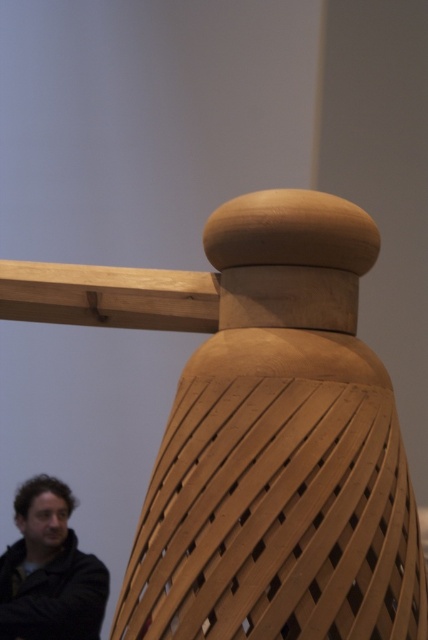
Question: Which object is farther from the camera taking this photo?

Choices:
 (A) dark brown leather jacket at lower left
 (B) natural wood chair at center

Answer: (A)

Question: Which point is farther from the camera taking this photo?

Choices:
 (A) (262, 256)
 (B) (80, 636)

Answer: (B)

Question: Which of the following is the farthest from the observer?

Choices:
 (A) (413, 605)
 (B) (67, 557)

Answer: (B)

Question: Is natural wood chair at center to the left of dark brown leather jacket at lower left from the viewer's perspective?

Choices:
 (A) no
 (B) yes

Answer: (A)

Question: Is natural wood chair at center to the left of dark brown leather jacket at lower left from the viewer's perspective?

Choices:
 (A) yes
 (B) no

Answer: (B)

Question: Does natural wood chair at center appear under dark brown leather jacket at lower left?

Choices:
 (A) no
 (B) yes

Answer: (A)